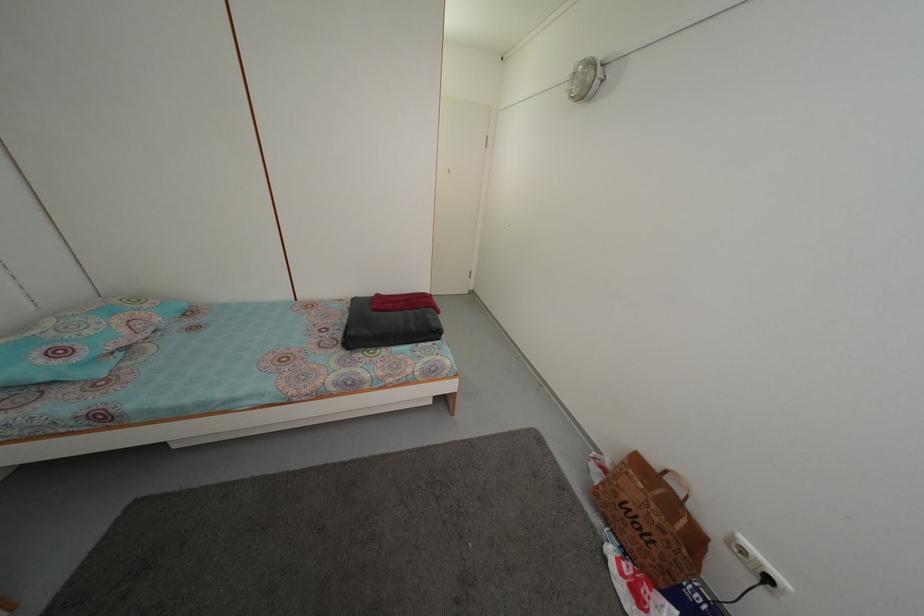
Find where to lift the black folded blanket. Please return your answer as a coordinate pair (x, y).

(387, 326)